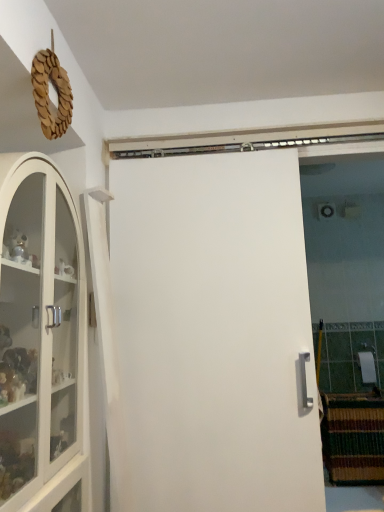
Question: Relative to white matte door at center, is white glass cabinet at left in front or behind?

Choices:
 (A) behind
 (B) front

Answer: (B)

Question: Considering the positions of white glass cabinet at left and white matte door at center in the image, is white glass cabinet at left wider or thinner than white matte door at center?

Choices:
 (A) thin
 (B) wide

Answer: (B)

Question: Considering the positions of point (62, 438) and point (284, 417), is point (62, 438) closer or farther from the camera than point (284, 417)?

Choices:
 (A) closer
 (B) farther

Answer: (A)

Question: Is white matte door at center situated inside white glass cabinet at left or outside?

Choices:
 (A) inside
 (B) outside

Answer: (B)

Question: In terms of width, does white matte door at center look wider or thinner when compared to white glass cabinet at left?

Choices:
 (A) thin
 (B) wide

Answer: (A)

Question: From the image's perspective, is white matte door at center located above or below white glass cabinet at left?

Choices:
 (A) below
 (B) above

Answer: (A)

Question: Considering the positions of white matte door at center and white glass cabinet at left in the image, is white matte door at center bigger or smaller than white glass cabinet at left?

Choices:
 (A) big
 (B) small

Answer: (B)